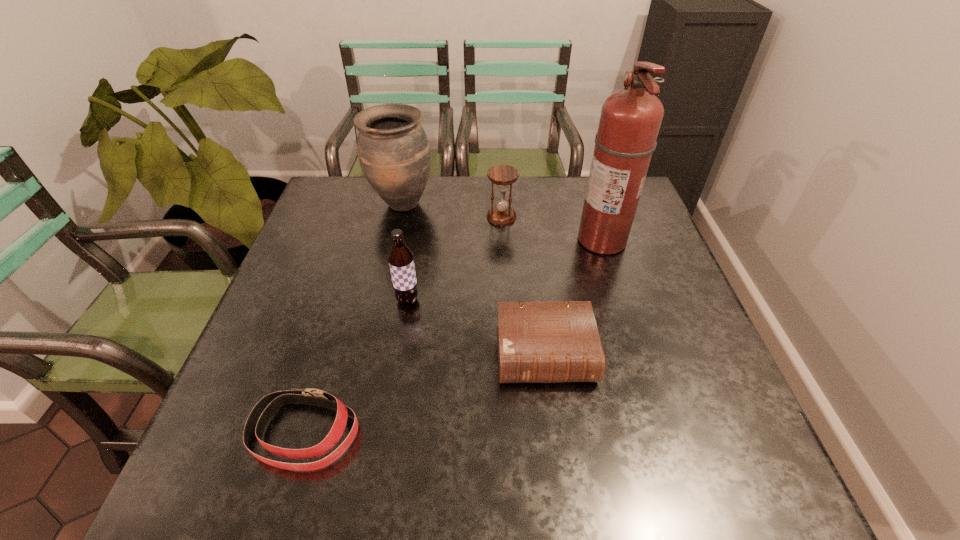
Where is `free location at the left edge of the desktop`? This screenshot has height=540, width=960. free location at the left edge of the desktop is located at coordinates (307, 340).

The image size is (960, 540). Find the location of `free spot at the right edge of the desktop`. free spot at the right edge of the desktop is located at coordinates (646, 280).

Where is `vacant area between the hourglass and the second tallest object`? The image size is (960, 540). vacant area between the hourglass and the second tallest object is located at coordinates (451, 210).

Find the location of a particular element. This screenshot has width=960, height=540. vacant space in between the nearest object and the hourglass is located at coordinates (403, 325).

The image size is (960, 540). Find the location of `vacant area that lies between the hourglass and the Bible`. vacant area that lies between the hourglass and the Bible is located at coordinates (523, 286).

You are a GUI agent. You are given a task and a screenshot of the screen. Output one action in this format:
    pyautogui.click(x=<x>, y=<y>)
    Task: Click on the free space between the hourglass and the urn
    This screenshot has width=960, height=540.
    Given the screenshot: What is the action you would take?
    pyautogui.click(x=451, y=210)

What are the coordinates of `free spot between the second shortest object and the shortest object` in the screenshot? It's located at (425, 394).

This screenshot has width=960, height=540. What are the coordinates of `free space between the third shortest object and the shortest object` in the screenshot? It's located at (403, 325).

Identify the location of vacant space in between the urn and the shortest object. (353, 319).

The image size is (960, 540). What are the coordinates of `free area in between the fifth shortest object and the shortest object` in the screenshot? It's located at tap(353, 319).